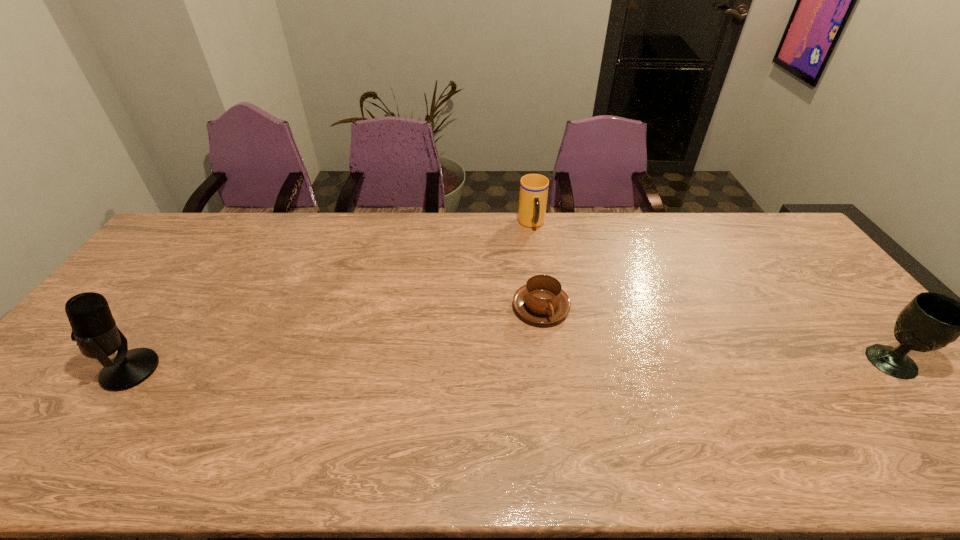
Identify the location of vacant space on the desktop that is between the tallest object and the chalice and is positioned on the side of the cup with the handle. This screenshot has width=960, height=540. (574, 366).

In order to click on vacant space on the desktop that is between the tallest object and the rightmost object and is positioned on the side of the shortest object with the handle in this screenshot , I will do `click(601, 365)`.